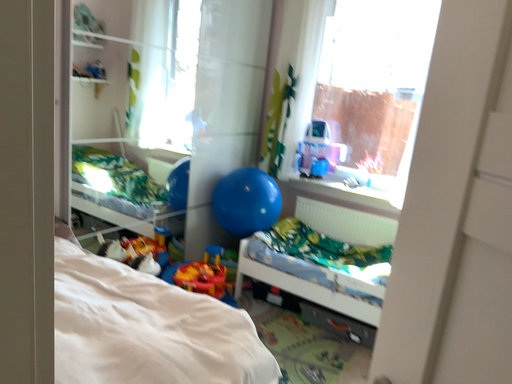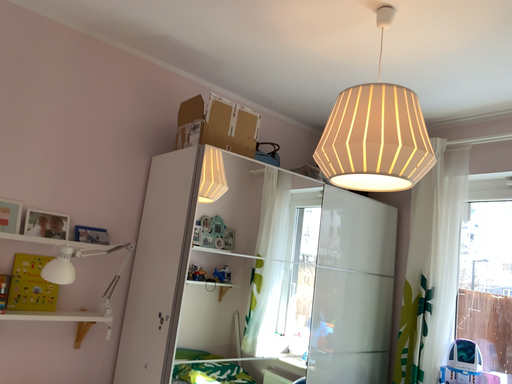
Question: How did the camera likely rotate when shooting the video?

Choices:
 (A) rotated right
 (B) rotated left

Answer: (B)